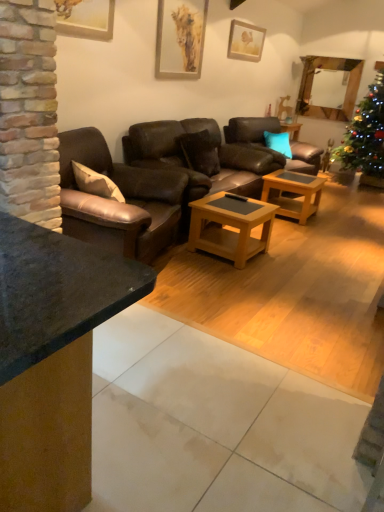
Question: Is teal fabric pillow at center, marked as the 1th pillow in a back-to-front arrangement, bigger or smaller than woodenwoodencoffee table at center, the 1th coffee table positioned from the right?

Choices:
 (A) small
 (B) big

Answer: (A)

Question: From the image's perspective, is teal fabric pillow at center, placed as the second pillow when sorted from front to back, positioned above or below woodenwoodencoffee table at center, which is the second coffee table in left-to-right order?

Choices:
 (A) above
 (B) below

Answer: (A)

Question: Estimate the real-world distances between objects in this image. Which object is farther from the brown leather couch at center, which appears as the 1th studio couch when viewed from the back?

Choices:
 (A) woodenwoodencoffee table at center, which is the 2th coffee table in back-to-front order
 (B) brown leather couch at center, the first studio couch viewed from the front
 (C) matte gold picture frame at upper center, which is the 2th picture frame from front to back
 (D) matte wooden picture frame at upper center, the third picture frame from the left
 (E) teal fabric pillow at center, the 1th pillow when ordered from right to left

Answer: (D)

Question: Which object is positioned closest to the woodenwoodencoffee table at center, which is the 2th coffee table in back-to-front order?

Choices:
 (A) brown leather couch at center, the second studio couch when ordered from back to front
 (B) teal fabric pillow at center, which is counted as the 2th pillow, starting from the left
 (C) brown leather couch at center, the second studio couch when ordered from front to back
 (D) matte wooden picture frame at upper center, the 1th picture frame viewed from the right
 (E) matte gold picture frame at upper center, the 2th picture frame viewed from the right

Answer: (C)